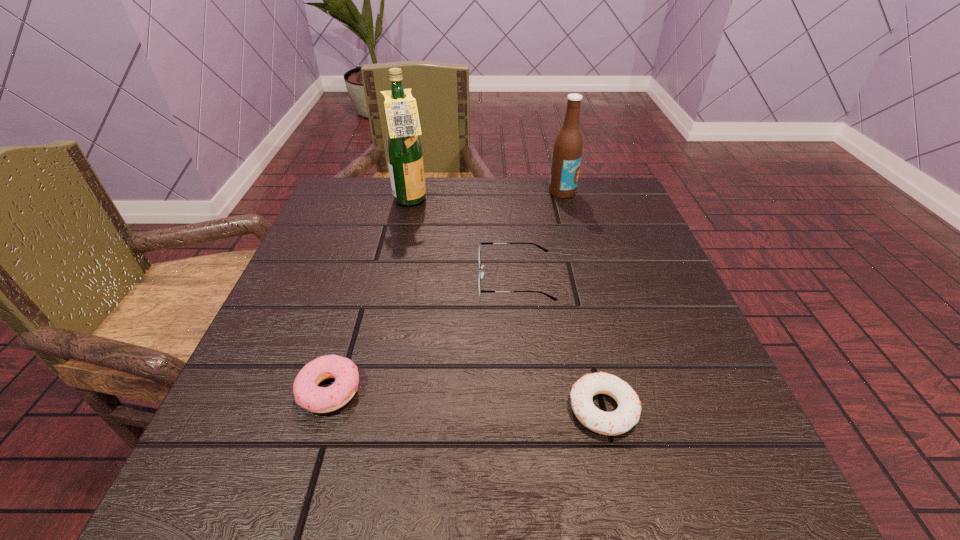
This screenshot has width=960, height=540. Identify the location of object situated at the far right corner. (567, 152).

The height and width of the screenshot is (540, 960). In the image, there is a desktop. In order to click on vacant space at the far edge in this screenshot , I will do `click(496, 180)`.

Where is `vacant position at the near edge of the desktop`? The image size is (960, 540). vacant position at the near edge of the desktop is located at coordinates (540, 478).

I want to click on free region at the left edge, so click(292, 294).

The width and height of the screenshot is (960, 540). I want to click on free space at the right edge of the desktop, so click(x=650, y=279).

The image size is (960, 540). What are the coordinates of `vacant space at the far left corner` in the screenshot? It's located at point(382,193).

You are a GUI agent. You are given a task and a screenshot of the screen. Output one action in this format:
    pyautogui.click(x=<x>, y=<y>)
    Task: Click on the vacant space at the far right corner
    Image resolution: width=960 pixels, height=540 pixels.
    Given the screenshot: What is the action you would take?
    pyautogui.click(x=620, y=195)

In the image, there is a desktop. Where is `vacant region at the near right corner`? vacant region at the near right corner is located at coordinates (668, 511).

Where is `vacant area that lies between the tallest object and the left doughnut`? This screenshot has height=540, width=960. vacant area that lies between the tallest object and the left doughnut is located at coordinates (x=371, y=296).

Find the location of a particular element. The image size is (960, 540). vacant area that lies between the beer bottle and the spectacles is located at coordinates (539, 235).